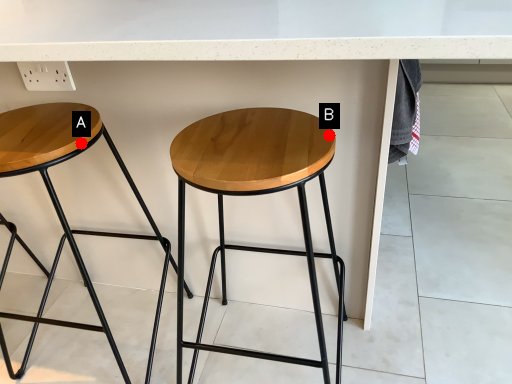
Question: Two points are circled on the image, labeled by A and B beside each circle. Which point is farther from the camera taking this photo?

Choices:
 (A) A is further
 (B) B is further

Answer: (A)